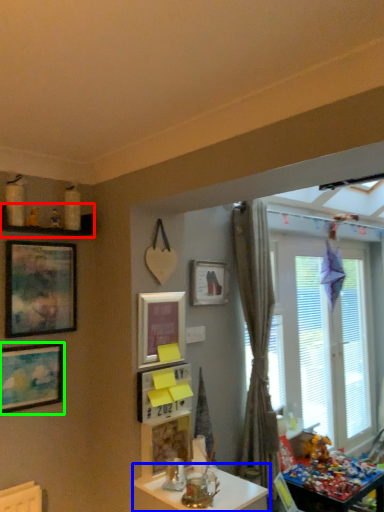
Question: Which is nearer to the shelf (highlighted by a red box)? table (highlighted by a blue box) or picture frame (highlighted by a green box).

Choices:
 (A) table
 (B) picture frame

Answer: (B)